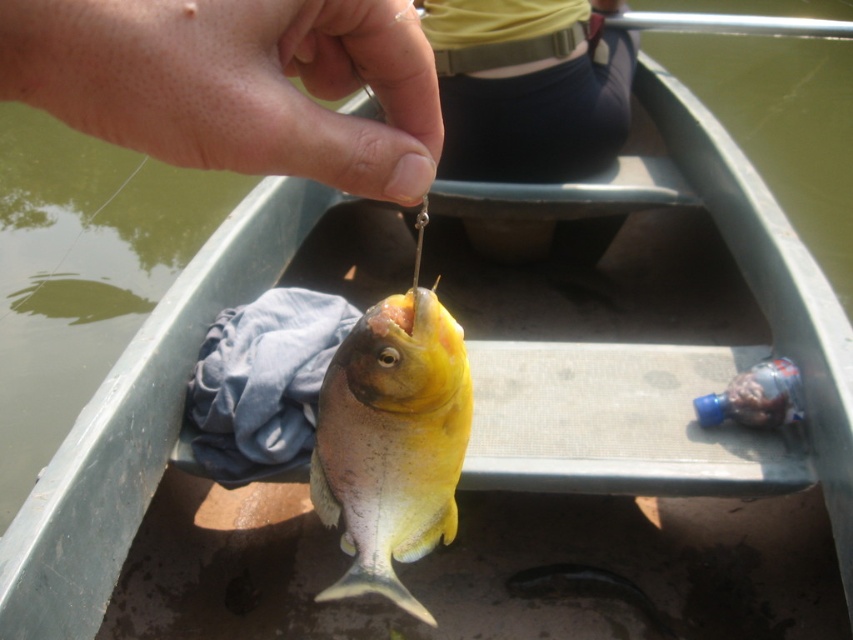
Between point (281, 3) and point (392, 352), which one is positioned in front?

Point (281, 3)

Does dry skin at center appear on the left side of yellow matte fish at center?

Indeed, dry skin at center is positioned on the left side of yellow matte fish at center.

Which is behind, point (206, 4) or point (398, 416)?

The point (398, 416) is behind.

Find the location of a particular element. The height and width of the screenshot is (640, 853). dry skin at center is located at coordinates (235, 83).